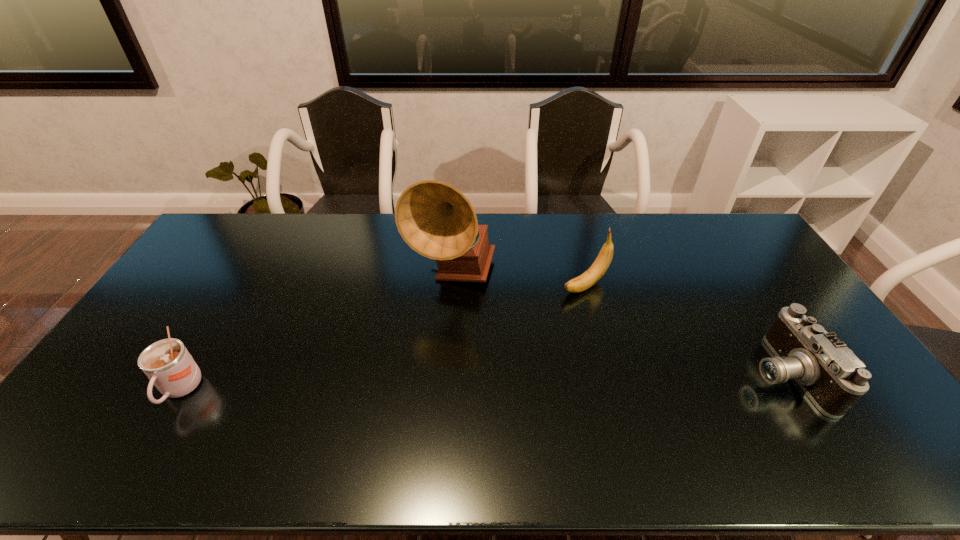
In order to click on free space on the desktop that is between the leftmost object and the camera and is positioned at the start of the peel on the third object from left to right in this screenshot , I will do `click(423, 383)`.

Find the location of a particular element. The height and width of the screenshot is (540, 960). vacant space on the desktop that is between the leftmost object and the rightmost object and is positioned on the horn of the tallest object is located at coordinates (493, 382).